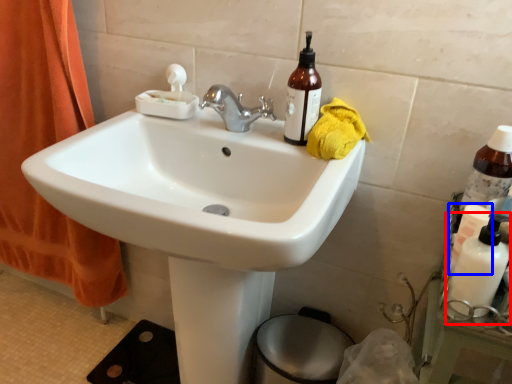
Question: Which object appears farthest to the camera in this image, cleaning product (highlighted by a red box) or toiletry (highlighted by a blue box)?

Choices:
 (A) cleaning product
 (B) toiletry

Answer: (B)